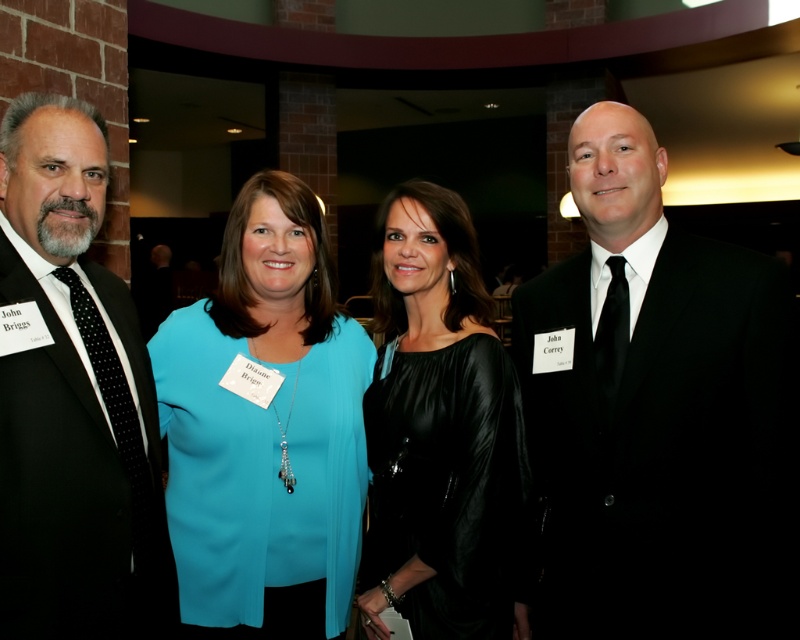
Question: Which of the following is the farthest from the observer?

Choices:
 (A) (256, 353)
 (B) (701, 376)
 (C) (90, 433)

Answer: (A)

Question: Which of the following is the closest to the observer?

Choices:
 (A) [330, 272]
 (B) [49, 216]
 (C) [378, 240]

Answer: (B)

Question: Can you confirm if teal fabric blouse at center is positioned below black suit at left?

Choices:
 (A) yes
 (B) no

Answer: (A)

Question: Is black suit at right bigger than black suit at left?

Choices:
 (A) no
 (B) yes

Answer: (B)

Question: Can you confirm if black suit at right is positioned to the right of teal fabric blouse at center?

Choices:
 (A) yes
 (B) no

Answer: (A)

Question: Which point appears farthest from the camera in this image?

Choices:
 (A) (381, 212)
 (B) (297, 403)
 (C) (14, 257)

Answer: (A)